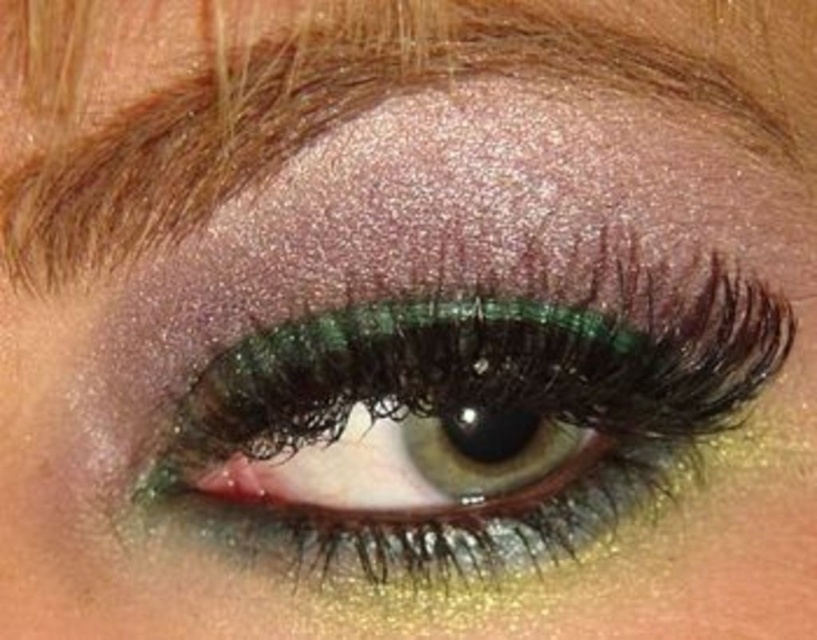
You are a makeup artist trying to apply eyeliner on the exact center of the eyelid. The coordinates given are point (483, 394). Based on the image description, where would this point be located?

The point (483, 394) corresponds to the shiny green eyeliner at center.

You are a makeup artist analyzing the eye makeup in the image. You notice two points marked on the eye. The first point is at coordinates point (x=458, y=560) and the second is at point (x=302, y=16). Which of these points is closer to the camera?

Point (x=458, y=560) is further to the camera than point (x=302, y=16), so the second point is closer to the camera.